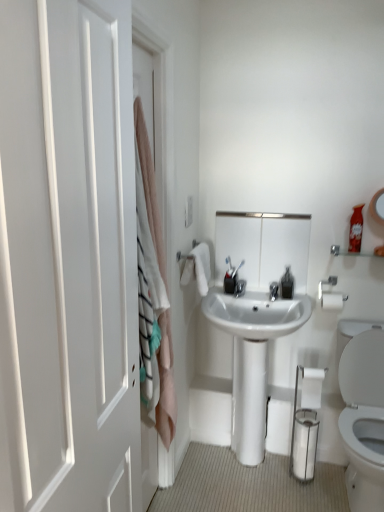
Measure the distance between point (141,118) and camera.

Point (141,118) and camera are 4.69 feet apart from each other.

Measure the distance between white glossy toilet paper at lower right and camera.

7.38 feet.

This screenshot has width=384, height=512. What do you see at coordinates (252, 358) in the screenshot?
I see `white glossy sink at center` at bounding box center [252, 358].

In order to face white matte door at left, should I rotate leftwards or rightwards?

A 14.607 degree turn to the left will do.

The image size is (384, 512). Describe the element at coordinates (263, 246) in the screenshot. I see `white glossy medicine cabinet at center` at that location.

The image size is (384, 512). What do you see at coordinates (330, 295) in the screenshot? I see `silver metallic towel bar at upper right` at bounding box center [330, 295].

In order to click on pink fabric curtain at left in this screenshot , I will do `click(150, 187)`.

Is white glossy medicine cabinet at center bigger than white glossy toilet paper at lower right?

Indeed, white glossy medicine cabinet at center has a larger size compared to white glossy toilet paper at lower right.

Are white glossy medicine cabinet at center and white glossy toilet paper at lower right making contact?

No, white glossy medicine cabinet at center is not with white glossy toilet paper at lower right.

Is white glossy toilet paper at lower right at the back of white glossy medicine cabinet at center?

No, white glossy toilet paper at lower right is not at the back of white glossy medicine cabinet at center.

Choose the correct answer: Is silver metallic towel bar at upper right inside white cotton towel at upper center or outside it?

silver metallic towel bar at upper right is not enclosed by white cotton towel at upper center.

Is silver metallic towel bar at upper right oriented towards white cotton towel at upper center?

No, silver metallic towel bar at upper right is not aimed at white cotton towel at upper center.

Between silver metallic towel bar at upper right and white cotton towel at upper center, which one has smaller width?

silver metallic towel bar at upper right is thinner.

From a real-world perspective, is pink fabric curtain at left located higher than metallic silver toothbrush at center?

Yes.

Between pink fabric curtain at left and metallic silver toothbrush at center, which one is positioned in front?

Positioned in front is pink fabric curtain at left.

Is metallic silver toothbrush at center at the back of pink fabric curtain at left?

No, metallic silver toothbrush at center is not at the back of pink fabric curtain at left.

Locate an element on the screen. This screenshot has width=384, height=512. toiletry that appears below the pink fabric curtain at left (from the image's perspective) is located at coordinates (230, 277).

From the image's perspective, is white matte door at left positioned above or below pink fabric curtain at left?

white matte door at left is situated lower than pink fabric curtain at left in the image.

Is white matte door at left oriented towards pink fabric curtain at left?

No.

Is point (119, 483) positioned in front of point (161, 410)?

Yes, point (119, 483) is in front of point (161, 410).

Who is smaller, white matte door at left or pink fabric curtain at left?

Smaller between the two is pink fabric curtain at left.

Looking at this image, from a real-world perspective, is white glossy toilet paper at lower right physically above white glossy sink at center?

Yes, from a real-world perspective, white glossy toilet paper at lower right is over white glossy sink at center

Considering the relative positions of white glossy toilet paper at lower right and white glossy sink at center in the image provided, is white glossy toilet paper at lower right to the right of white glossy sink at center from the viewer's perspective?

Yes.

Is white glossy sink at center surrounded by white glossy toilet paper at lower right?

No, white glossy toilet paper at lower right does not contain white glossy sink at center.

Is white glossy toilet paper at lower right smaller than white glossy sink at center?

Correct, white glossy toilet paper at lower right occupies less space than white glossy sink at center.

In the scene shown: Considering the sizes of objects white glossy sink at center and silver metallic towel bar at upper right in the image provided, who is shorter, white glossy sink at center or silver metallic towel bar at upper right?

Standing shorter between the two is silver metallic towel bar at upper right.

This screenshot has height=512, width=384. I want to click on sink on the left of silver metallic towel bar at upper right, so click(252, 358).

Are white glossy sink at center and silver metallic towel bar at upper right far apart?

That's not correct — white glossy sink at center is a little close to silver metallic towel bar at upper right.

Which of these two, white glossy sink at center or metallic silver toothbrush at center, stands taller?

With more height is white glossy sink at center.

Which object is further away from the camera taking this photo, white glossy sink at center or metallic silver toothbrush at center?

metallic silver toothbrush at center is further from the camera.

From a real-world perspective, which is physically above, white glossy sink at center or metallic silver toothbrush at center?

In real-world perspective, metallic silver toothbrush at center is above.

Is white glossy sink at center touching metallic silver toothbrush at center?

No, white glossy sink at center is not touching metallic silver toothbrush at center.

Where is `toilet paper beneath the white glossy medicine cabinet at center (from a real-world perspective)`? This screenshot has width=384, height=512. toilet paper beneath the white glossy medicine cabinet at center (from a real-world perspective) is located at coordinates (312, 387).

Where is `towel bar lying below the white cotton towel at upper center (from the image's perspective)`? This screenshot has width=384, height=512. towel bar lying below the white cotton towel at upper center (from the image's perspective) is located at coordinates (330, 295).

Considering their positions, is white matte door at left positioned further to silver metallic towel bar at upper right than white cotton towel at upper center?

Among the two, white matte door at left is located further to silver metallic towel bar at upper right.

Considering their positions, is white cotton towel at upper center positioned closer to white glossy toilet paper at lower right than white glossy sink at center?

Based on the image, white glossy sink at center appears to be nearer to white glossy toilet paper at lower right.

Looking at the image, which one is located closer to silver metallic towel bar at upper right, white glossy toilet paper at lower right or white matte door at left?

white glossy toilet paper at lower right is closer to silver metallic towel bar at upper right.

Estimate the real-world distances between objects in this image. Which object is closer to white cotton towel at upper center, white glossy toilet paper at lower right or white glossy sink at center?

white glossy sink at center.

Looking at the image, which one is located closer to clear plastic soap dispenser at center, white glossy sink at center or white cotton towel at upper center?

The object closer to clear plastic soap dispenser at center is white glossy sink at center.

From the image, which object appears to be nearer to clear plastic soap dispenser at center, silver metallic towel bar at upper right or white glossy medicine cabinet at center?

silver metallic towel bar at upper right is positioned closer to the anchor clear plastic soap dispenser at center.

Based on their spatial positions, is clear plastic soap dispenser at center or white matte door at left closer to white glossy medicine cabinet at center?

clear plastic soap dispenser at center is positioned closer to the anchor white glossy medicine cabinet at center.

Based on their spatial positions, is white matte door at left or pink fabric curtain at left further from white glossy toilet paper at lower right?

white matte door at left lies further to white glossy toilet paper at lower right than the other object.

Identify the location of toilet paper between white matte door at left and silver metallic towel bar at upper right from front to back. This screenshot has height=512, width=384. point(312,387).

Image resolution: width=384 pixels, height=512 pixels. I want to click on towel bar located between white matte door at left and white glossy medicine cabinet at center in the depth direction, so [x=330, y=295].

The height and width of the screenshot is (512, 384). What are the coordinates of `towel bar between pink fabric curtain at left and clear plastic soap dispenser at center from front to back` in the screenshot? It's located at (330, 295).

Locate an element on the screen. The image size is (384, 512). toiletry between white cotton towel at upper center and silver metallic towel bar at upper right is located at coordinates (230, 277).